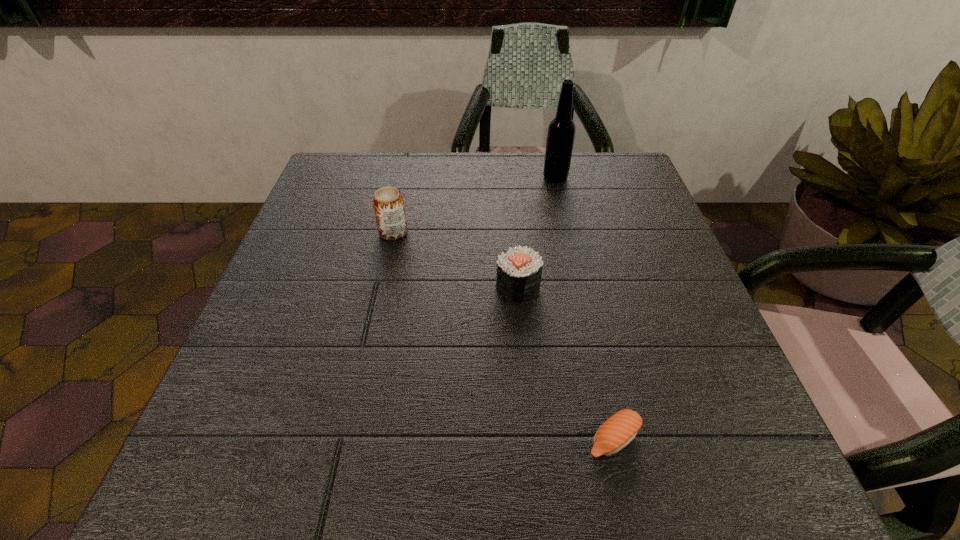
Identify the location of the tallest object. The width and height of the screenshot is (960, 540). (561, 132).

Where is `beer bottle`? beer bottle is located at coordinates (561, 132).

The width and height of the screenshot is (960, 540). Identify the location of the leftmost object. (388, 204).

The height and width of the screenshot is (540, 960). I want to click on beer can, so (388, 204).

Where is `the third tallest object`? The image size is (960, 540). the third tallest object is located at coordinates (519, 270).

The width and height of the screenshot is (960, 540). I want to click on the farther sushi, so click(519, 270).

Where is `the shorter sushi`? This screenshot has width=960, height=540. the shorter sushi is located at coordinates (620, 429).

This screenshot has width=960, height=540. In order to click on the nearer sushi in this screenshot , I will do `click(620, 429)`.

This screenshot has width=960, height=540. Find the location of `blank space located 0.270m on the front of the farthest object`. blank space located 0.270m on the front of the farthest object is located at coordinates (573, 257).

The height and width of the screenshot is (540, 960). I want to click on free space located 0.140m on the right of the third nearest object, so click(471, 233).